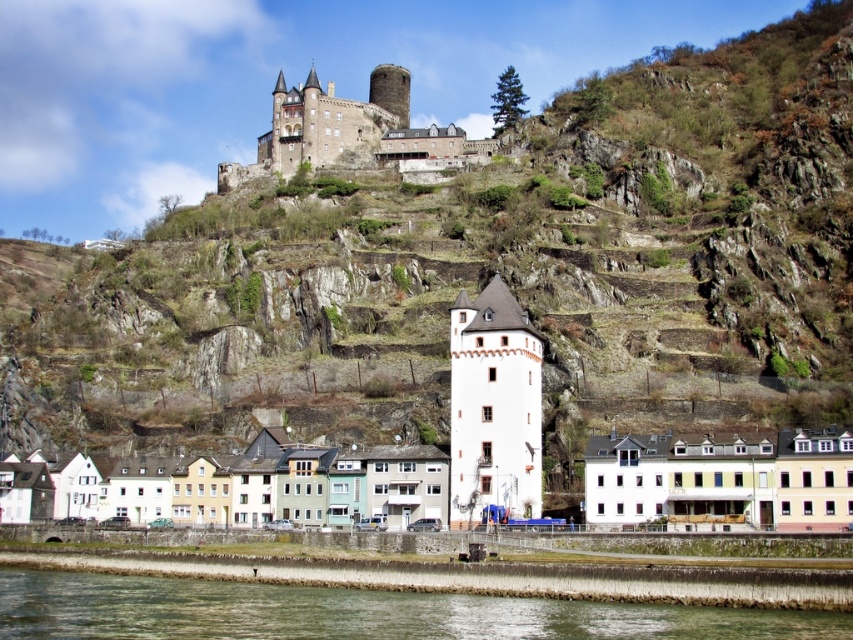
You are a tourist standing on the riverside embankment and want to take a photo of the stone castle at upper center. The clear water at lower center is in your way. Can you walk around it to get a better view?

The clear water at lower center is 328.15 feet away from the stone castle at upper center. Since the water is at the lower center and the castle is at the upper center, you can walk along the embankment to either side to find a clear vantage point away from the water obstruction.

You are a tourist standing on the riverside embankment and want to take a photo that includes both the white matte building at lower center and the white smooth tower at center. Which object should you position closer to the edge of the frame to ensure both are fully visible?

Since the white matte building at lower center is larger than the white smooth tower at center, you should position the white smooth tower at center closer to the edge of the frame to ensure both are fully visible.